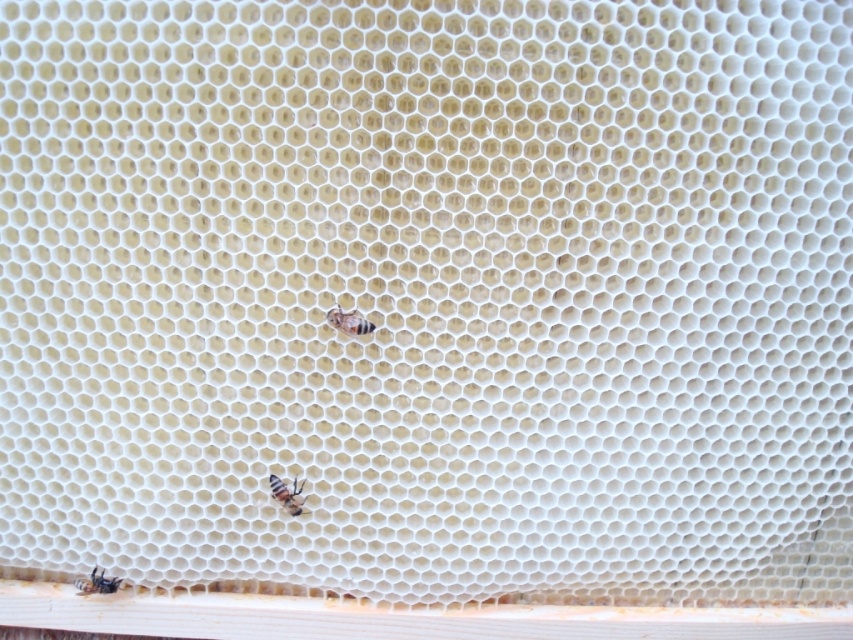
Can you confirm if translucent yellowish honeycomb at center is positioned to the right of translucent yellowish honeycomb at lower left?

Correct, you'll find translucent yellowish honeycomb at center to the right of translucent yellowish honeycomb at lower left.

Looking at this image, does translucent yellowish honeycomb at center have a greater height compared to translucent yellowish honeycomb at lower left?

No, translucent yellowish honeycomb at center is not taller than translucent yellowish honeycomb at lower left.

Find the location of `translucent yellowish honeycomb at center`. translucent yellowish honeycomb at center is located at coordinates (347, 321).

At what (x,y) coordinates should I click in order to perform the action: click on translucent yellowish honeycomb at center. Please return your answer as a coordinate pair (x, y). Looking at the image, I should click on (347, 321).

Is translucent yellow bee at lower center positioned before translucent yellowish honeycomb at lower left?

Yes.

Does point (285, 506) come closer to viewer compared to point (88, 579)?

Yes.

Where is `translucent yellow bee at lower center`? The image size is (853, 640). translucent yellow bee at lower center is located at coordinates (287, 493).

Can you confirm if translucent yellowish honeycomb at center is bigger than translucent yellow bee at lower center?

Incorrect, translucent yellowish honeycomb at center is not larger than translucent yellow bee at lower center.

Identify the location of translucent yellowish honeycomb at center. The height and width of the screenshot is (640, 853). (347, 321).

Is point (341, 323) farther from viewer compared to point (297, 506)?

No, it is in front of (297, 506).

Where is `translucent yellowish honeycomb at center`? The image size is (853, 640). translucent yellowish honeycomb at center is located at coordinates (347, 321).